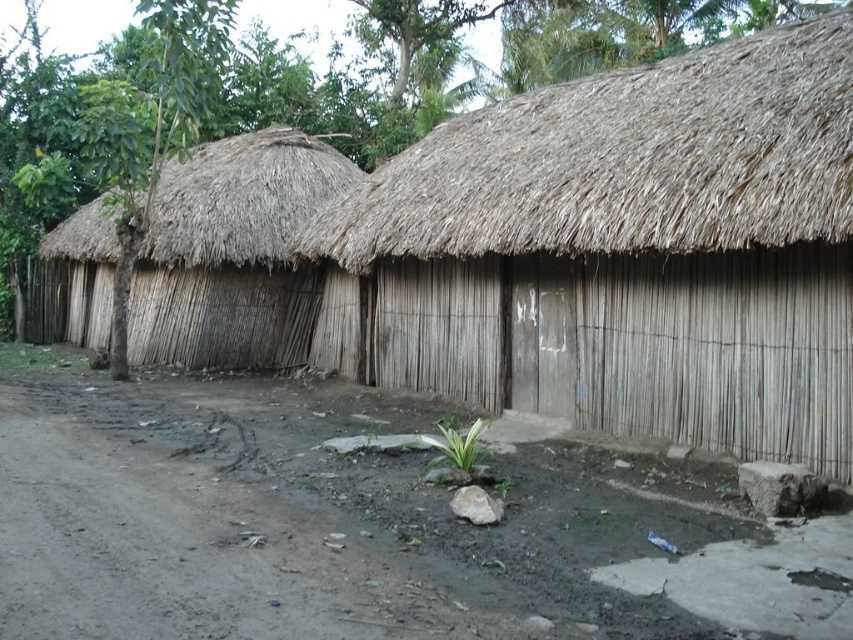
Question: Does brown thatch roof at upper center come in front of natural straw hut at left?

Choices:
 (A) yes
 (B) no

Answer: (A)

Question: Does brown dirt track at lower left have a larger size compared to natural straw hut at left?

Choices:
 (A) yes
 (B) no

Answer: (B)

Question: Which of these objects is positioned farthest from the brown dirt track at lower left?

Choices:
 (A) natural straw hut at left
 (B) brown thatch roof at upper center

Answer: (A)

Question: Is brown dirt track at lower left below brown thatch roof at upper center?

Choices:
 (A) no
 (B) yes

Answer: (B)

Question: Which point is farther to the camera?

Choices:
 (A) natural straw hut at left
 (B) brown dirt track at lower left
 (C) brown thatch roof at upper center

Answer: (A)

Question: Which is farther from the brown thatch roof at upper center?

Choices:
 (A) brown dirt track at lower left
 (B) natural straw hut at left

Answer: (B)